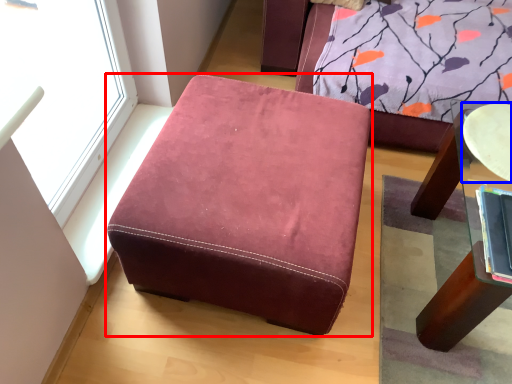
Question: Which point is further to the camera, furniture (highlighted by a red box) or round table (highlighted by a blue box)?

Choices:
 (A) furniture
 (B) round table

Answer: (B)